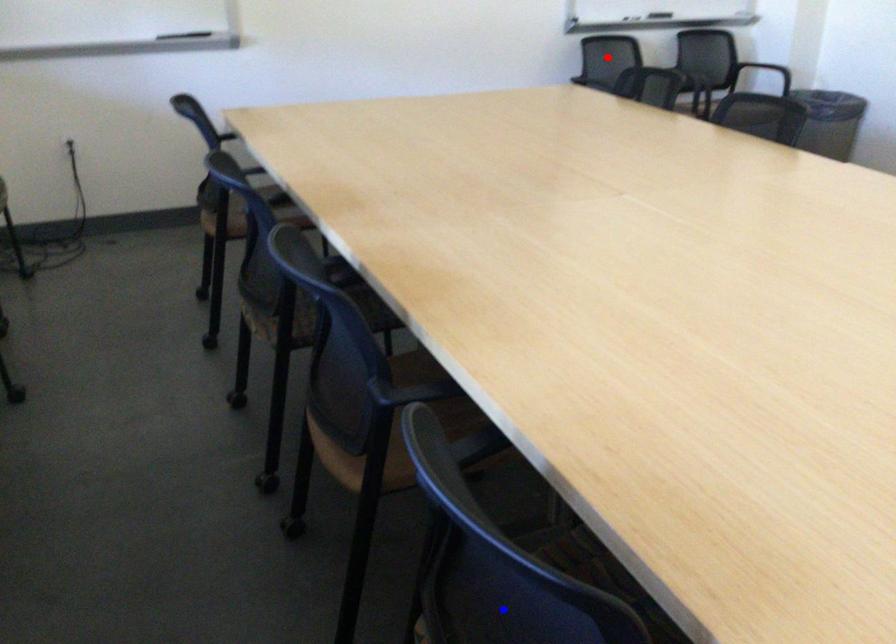
Question: Two points are marked on the image. Which point is closer to the camera?

Choices:
 (A) Blue point is closer.
 (B) Red point is closer.

Answer: (A)